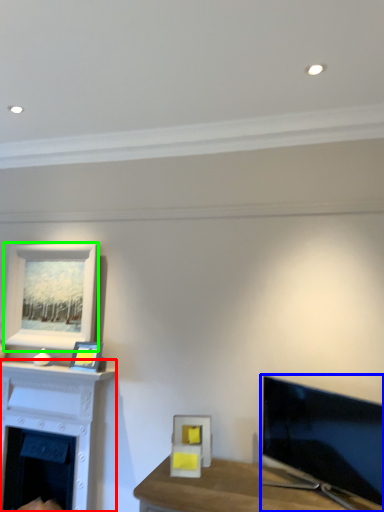
Question: Which object is positioned closest to fireplace (highlighted by a red box)? Select from television (highlighted by a blue box) and picture frame (highlighted by a green box).

Choices:
 (A) television
 (B) picture frame

Answer: (B)